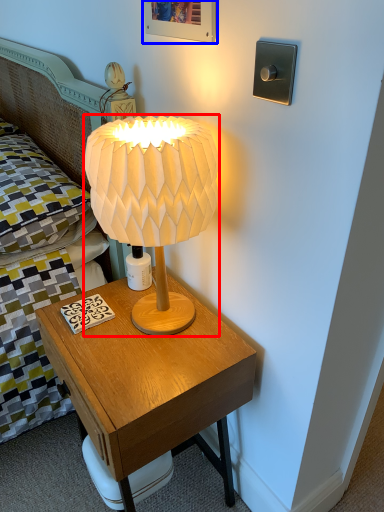
Question: Which object appears closest to the camera in this image, lamp (highlighted by a red box) or picture frame (highlighted by a blue box)?

Choices:
 (A) lamp
 (B) picture frame

Answer: (A)